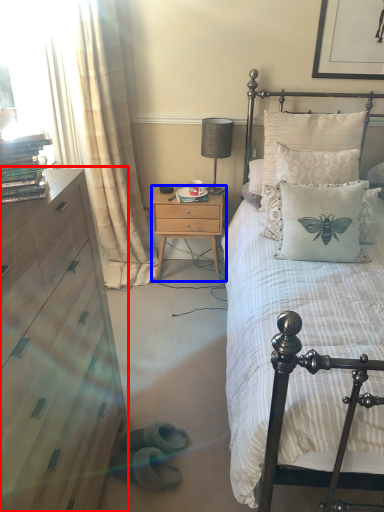
Question: Which object appears closest to the camera in this image, chest of drawers (highlighted by a red box) or nightstand (highlighted by a blue box)?

Choices:
 (A) chest of drawers
 (B) nightstand

Answer: (A)